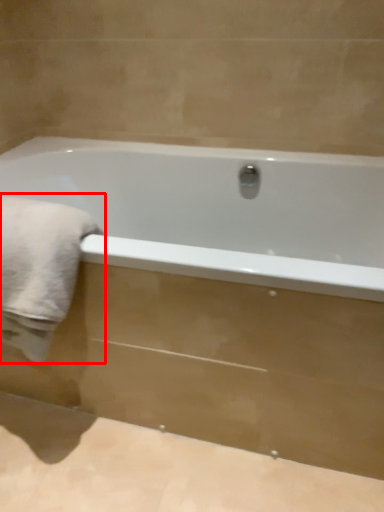
Question: Observing the image, what is the correct spatial positioning of bath towel (annotated by the red box) in reference to bathtub?

Choices:
 (A) left
 (B) right

Answer: (A)